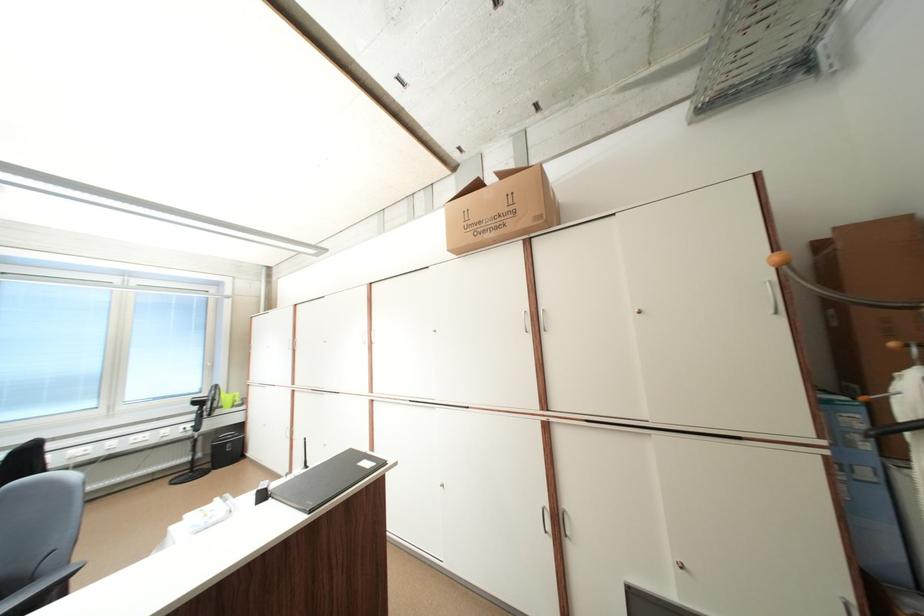
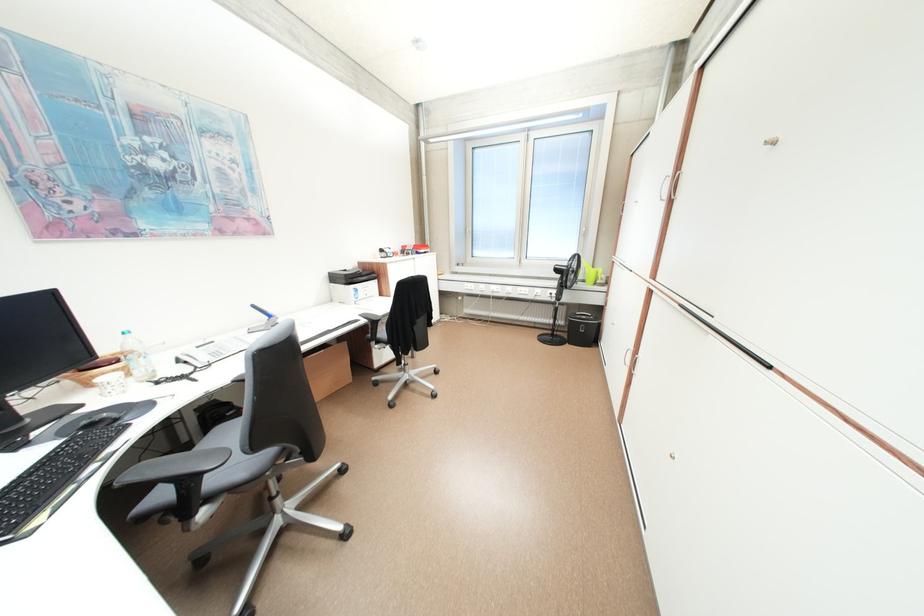
The point at (216,466) is marked in the first image. Where is the corresponding point in the second image?

(576, 337)